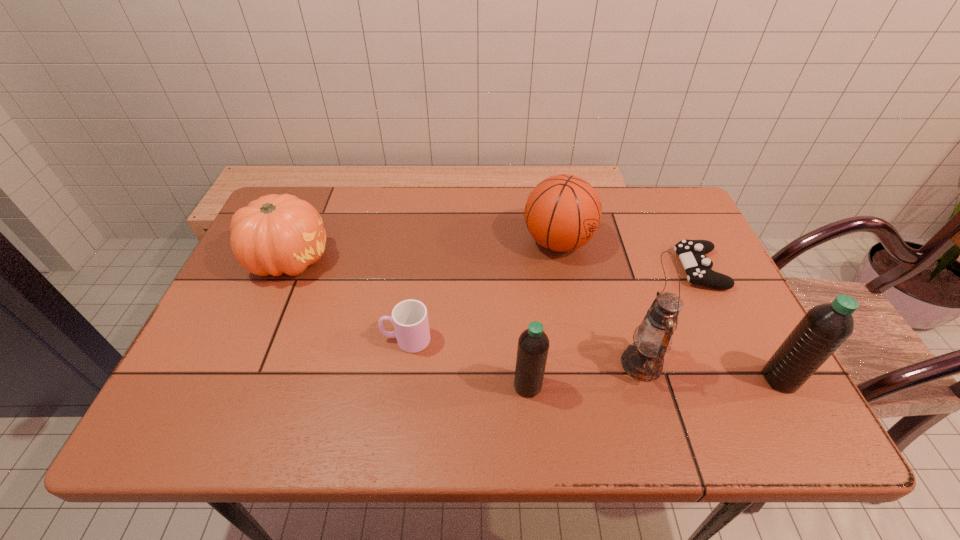
This screenshot has height=540, width=960. I want to click on vacant position located 0.210m on the left of the sixth shortest object, so click(664, 379).

Locate an element on the screen. The image size is (960, 540). free region located on the front of the basketball is located at coordinates (570, 311).

At what (x,y) coordinates should I click in order to perform the action: click on vacant area situated 0.180m with the handle on the side of the sixth tallest object. Please return your answer as a coordinate pair (x, y). The image size is (960, 540). Looking at the image, I should click on (303, 340).

Identify the location of vacant area situated 0.090m with the handle on the side of the sixth tallest object. The height and width of the screenshot is (540, 960). (343, 340).

Image resolution: width=960 pixels, height=540 pixels. In order to click on free location located 0.230m with the handle on the side of the sixth tallest object in this screenshot , I will do `click(281, 340)`.

In order to click on vacant space situated 0.120m on the surface of the shortest object in this screenshot , I will do `click(633, 269)`.

Where is `vacant space located 0.050m on the surface of the shortest object`? vacant space located 0.050m on the surface of the shortest object is located at coordinates (660, 269).

At what (x,y) coordinates should I click in order to perform the action: click on free point located on the surface of the shortest object. Please return your answer as a coordinate pair (x, y). Looking at the image, I should click on (660, 269).

This screenshot has width=960, height=540. I want to click on free point located on the carved face of the pumpkin, so click(373, 259).

Locate an element on the screen. vacant space located on the back of the tallest object is located at coordinates 614,273.